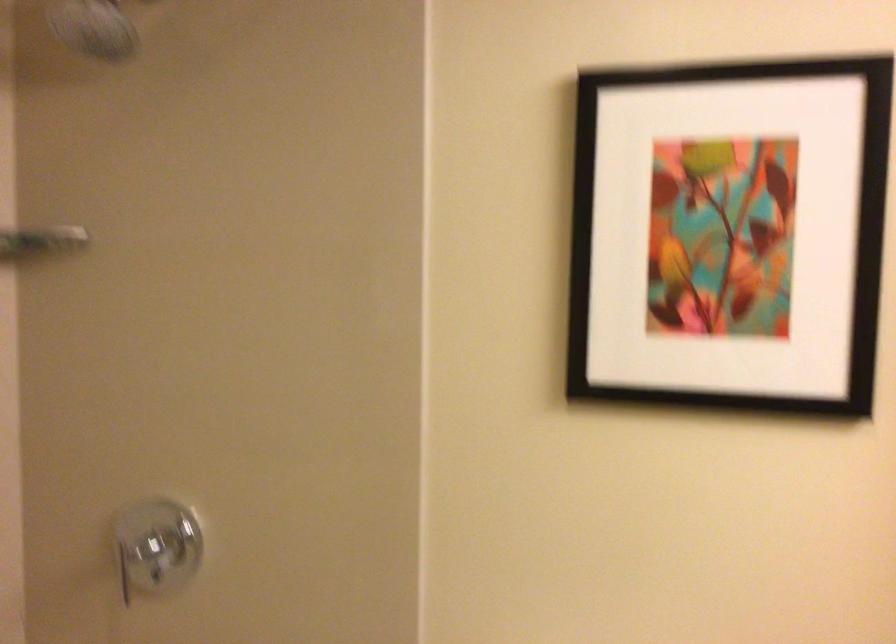
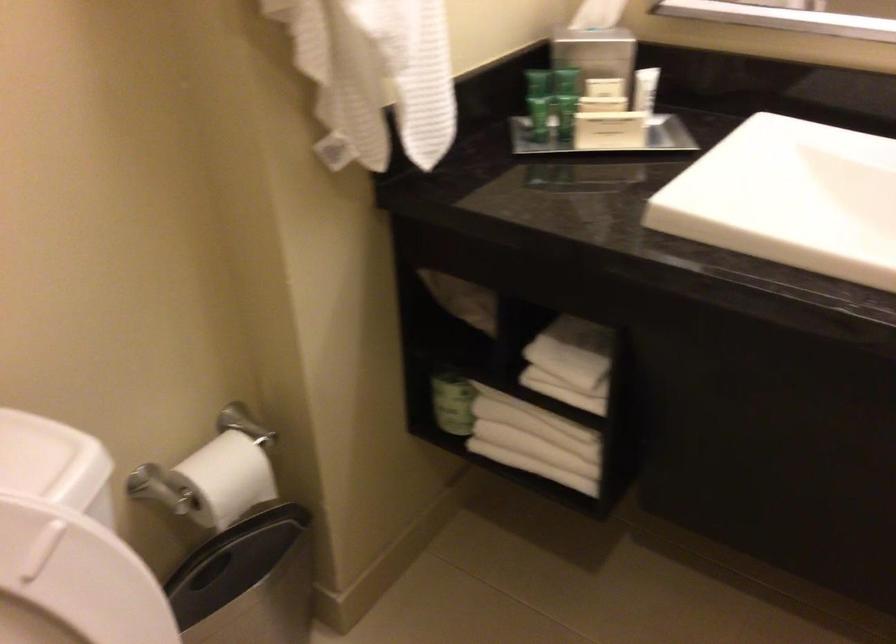
How did the camera likely rotate?

The rotation direction of the camera is right-down.